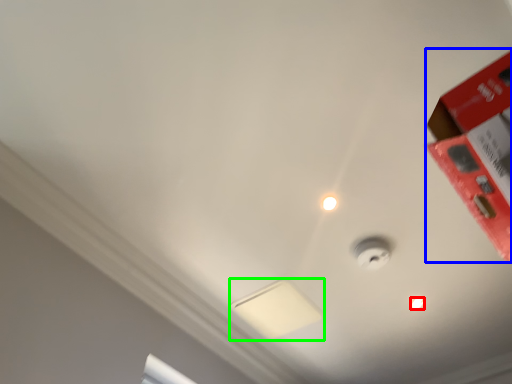
Question: Based on their relative distances, which object is farther from light bulb (highlighted by a red box)? Choose from box (highlighted by a blue box) and lamp (highlighted by a green box).

Choices:
 (A) box
 (B) lamp

Answer: (A)